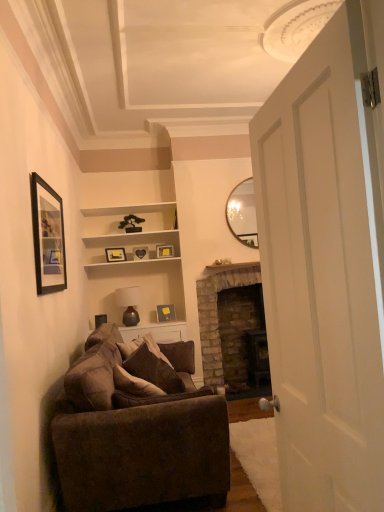
Question: Which direction should I rotate to look at matte gold picture frame at center, which is counted as the 2th picture frame, starting from the back?

Choices:
 (A) right
 (B) left

Answer: (B)

Question: Is velvet brown couch at left thinner than matte gold picture frame at center, the 3th picture frame when ordered from top to bottom?

Choices:
 (A) yes
 (B) no

Answer: (B)

Question: From the image's perspective, would you say velvet brown couch at left is positioned over matte gold picture frame at center, the fourth picture frame from the front?

Choices:
 (A) yes
 (B) no

Answer: (B)

Question: From the image's perspective, is velvet brown couch at left beneath matte gold picture frame at center, the 3th picture frame when ordered from top to bottom?

Choices:
 (A) no
 (B) yes

Answer: (B)

Question: Is velvet brown couch at left closer to the viewer compared to matte gold picture frame at center, the third picture frame from the back?

Choices:
 (A) no
 (B) yes

Answer: (B)

Question: From a real-world perspective, does velvet brown couch at left sit lower than matte gold picture frame at center, the 3th picture frame when ordered from top to bottom?

Choices:
 (A) no
 (B) yes

Answer: (B)

Question: Are velvet brown couch at left and matte gold picture frame at center, the 3th picture frame when ordered from top to bottom, far apart?

Choices:
 (A) no
 (B) yes

Answer: (B)

Question: Is matte brown glass lamp at center thinner than matte gold picture frame at center, the first picture frame viewed from the back?

Choices:
 (A) no
 (B) yes

Answer: (A)

Question: From a real-world perspective, is matte brown glass lamp at center over matte gold picture frame at center, the first picture frame viewed from the back?

Choices:
 (A) no
 (B) yes

Answer: (A)

Question: Considering the relative sizes of matte brown glass lamp at center and matte gold picture frame at center, the 6th picture frame when ordered from front to back, in the image provided, is matte brown glass lamp at center smaller than matte gold picture frame at center, the 6th picture frame when ordered from front to back,?

Choices:
 (A) yes
 (B) no

Answer: (B)

Question: Would you say matte brown glass lamp at center contains matte gold picture frame at center, acting as the fifth picture frame starting from the bottom?

Choices:
 (A) no
 (B) yes

Answer: (A)

Question: Is matte brown glass lamp at center with matte gold picture frame at center, the first picture frame viewed from the back?

Choices:
 (A) yes
 (B) no

Answer: (B)

Question: Can you confirm if matte brown glass lamp at center is shorter than matte gold picture frame at center, the 6th picture frame when ordered from front to back?

Choices:
 (A) no
 (B) yes

Answer: (A)

Question: From a real-world perspective, is brick fireplace at center physically below white matte door at right?

Choices:
 (A) yes
 (B) no

Answer: (A)